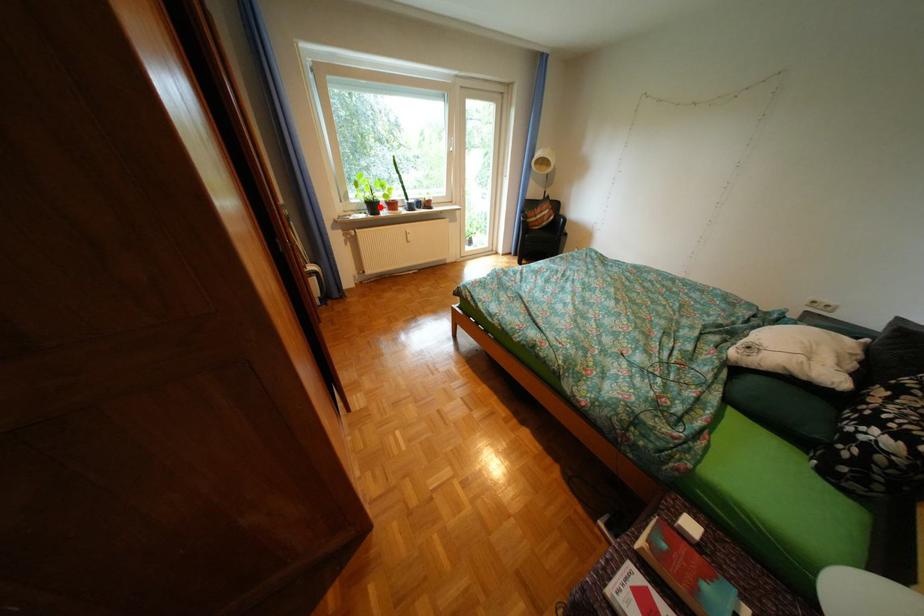
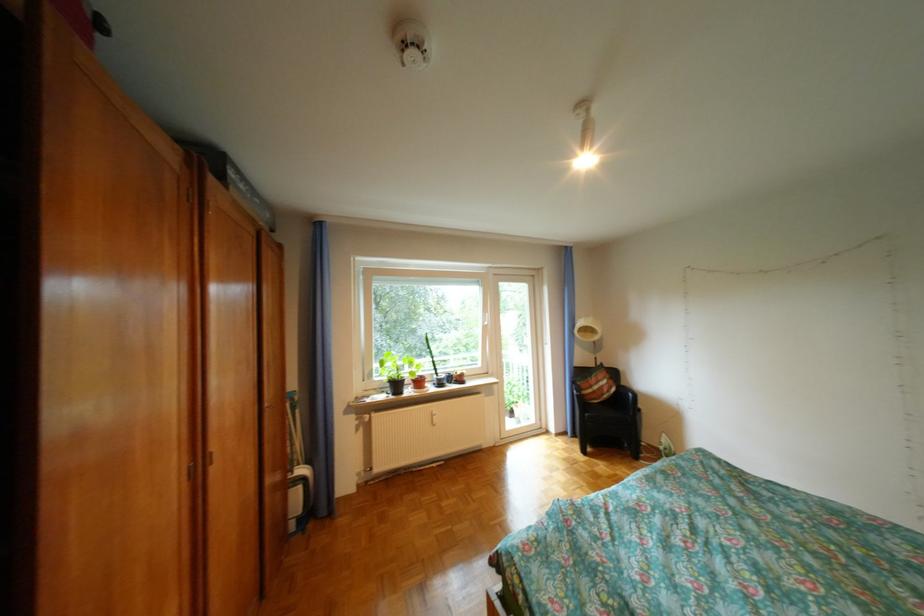
Question: I am providing you with two images of the same scene from different viewpoints. Image1 has a red point marked. In image2, the corresponding 3D location appears at what relative position? Reply with the corresponding letter.

Choices:
 (A) Closer
 (B) Farther

Answer: (B)